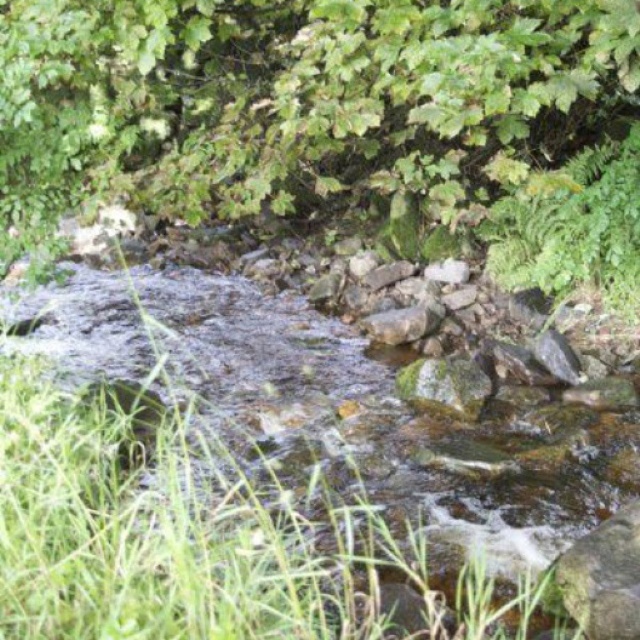
You are standing at the edge of the stream and see two points marked in the scene. The first point is at coordinates point (429,632) and the second is at point (604,566). Which point is closer to you?

Point (429,632) is in front of point (604,566), so it is closer to you.

Looking at this image, you are standing at the edge of the stream and want to step onto the smooth gray rock at lower right. Is the green grass at center blocking your path to the rock?

The green grass at center is positioned over the smooth gray rock at lower right, so the grass is covering the rock and blocking your path.